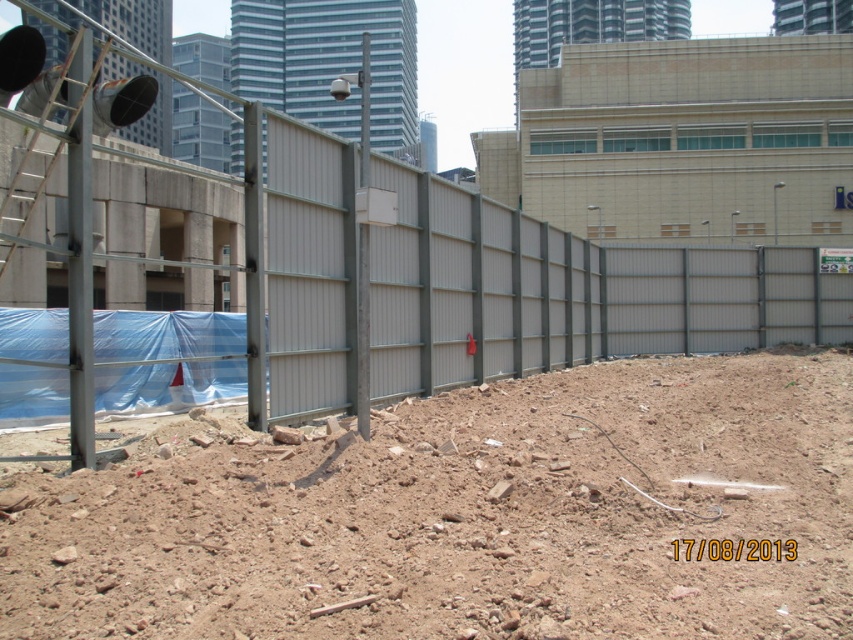
You are a construction worker assessing the site layout. You need to determine which area is smaller in size between the brown dirt field at center and the metallic gray fence at center. Which one is smaller?

The brown dirt field at center occupies less space than the metallic gray fence at center, so the brown dirt field at center is smaller in size.

You are a construction worker standing at the entrance of the site. You need to move a heavy equipment from the brown dirt field at center to the metallic gray fence at center. Which direction should you move the equipment to reach the fence?

You should move the equipment to the right since the brown dirt field at center is to the left of the metallic gray fence at center, so moving right will bring it towards the fence.

You are a delivery truck driver who needs to unload supplies to the construction site. The truck is 3.5 meters wide. Can you safely drive through the gap between the brown dirt field at center and the metallic gray fence at center?

The gap between the brown dirt field at center and the metallic gray fence at center is 4.80 meters, which is wider than the truck width of 3.5 meters. Therefore, the truck can safely pass through the gap.